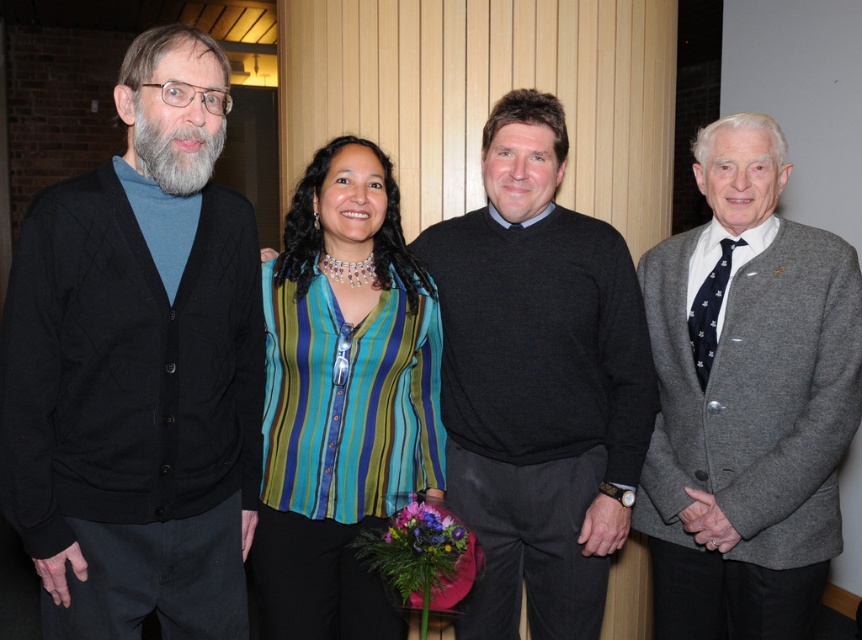
Question: Which point appears farthest from the camera in this image?

Choices:
 (A) (367, 452)
 (B) (456, 227)
 (C) (679, 541)

Answer: (B)

Question: Which point is farther to the camera?

Choices:
 (A) (335, 166)
 (B) (759, 509)
 (C) (625, 492)
 (D) (223, 216)

Answer: (C)

Question: Is black cardigan at left to the right of striped fabric blouse at center from the viewer's perspective?

Choices:
 (A) yes
 (B) no

Answer: (B)

Question: Estimate the real-world distances between objects in this image. Which object is farther from the black cardigan at left?

Choices:
 (A) striped fabric blouse at center
 (B) dark gray sweater at center
 (C) gray wool cardigan at right

Answer: (C)

Question: From the image, what is the correct spatial relationship of dark gray sweater at center in relation to striped fabric blouse at center?

Choices:
 (A) right
 (B) left

Answer: (A)

Question: Is gray wool cardigan at right positioned before striped fabric blouse at center?

Choices:
 (A) yes
 (B) no

Answer: (B)